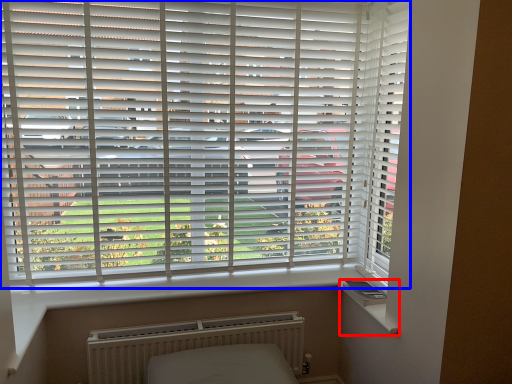
Question: Which object is closer to the camera taking this photo, window sill (highlighted by a red box) or window blind (highlighted by a blue box)?

Choices:
 (A) window sill
 (B) window blind

Answer: (B)